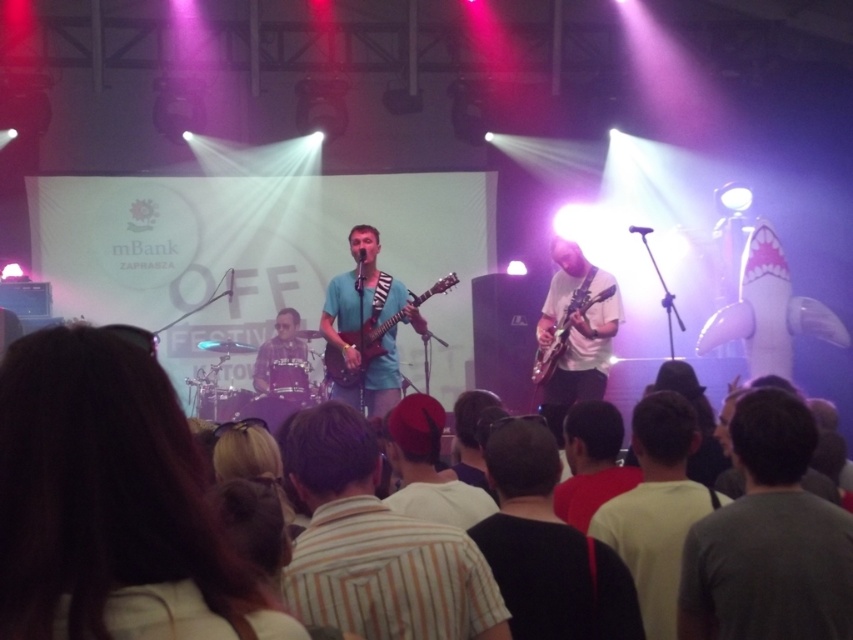
Looking at this image, how distant is gray cotton shirt at center from glossy wood guitar at center?

gray cotton shirt at center and glossy wood guitar at center are 3.79 meters apart.

Between gray cotton shirt at center and glossy wood guitar at center, which one appears on the right side from the viewer's perspective?

Positioned to the right is glossy wood guitar at center.

Identify the location of gray cotton shirt at center. The height and width of the screenshot is (640, 853). (769, 540).

Does red shirt at center appear on the right side of plaid fabric shirt at center?

Yes, red shirt at center is to the right of plaid fabric shirt at center.

Is point (567, 512) closer to viewer compared to point (305, 348)?

Yes.

Between point (570, 500) and point (257, 381), which one is positioned behind?

The point (257, 381) is more distant.

Find the location of `red shirt at center`. red shirt at center is located at coordinates (590, 461).

Which is more to the right, striped cotton shirt at center or red felt hat at center?

Positioned to the right is red felt hat at center.

Is point (424, 634) positioned before point (462, 513)?

That is True.

Between point (347, 496) and point (410, 460), which one is positioned in front?

Point (347, 496) is more forward.

I want to click on striped cotton shirt at center, so click(x=376, y=545).